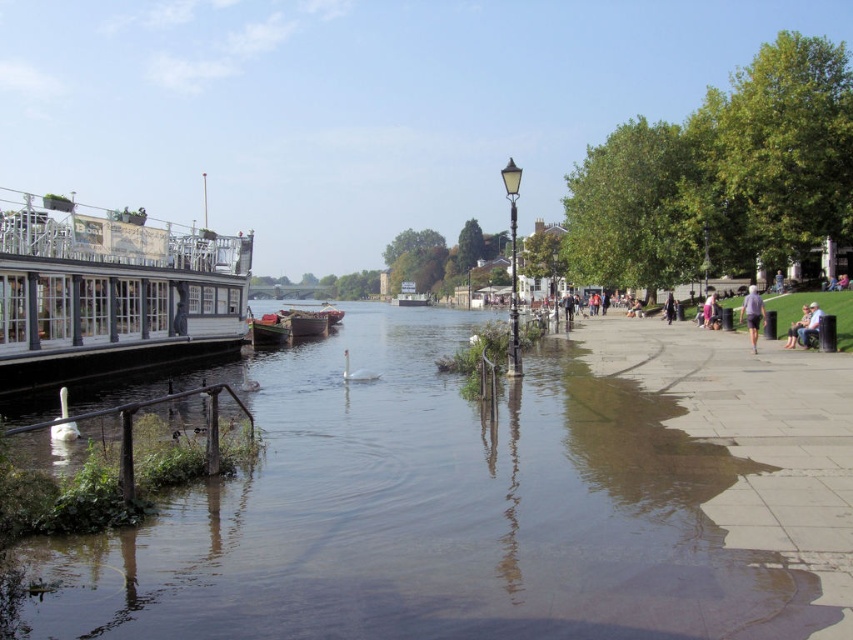
You are a photographer planning to take a photo of the white wooden boat at left and the gray fabric pants at lower right. Which object should you focus on first if you want to capture both in a single frame without moving the camera?

You should focus on the white wooden boat at left first because it is taller than the gray fabric pants at lower right, so it will occupy more space in the frame.